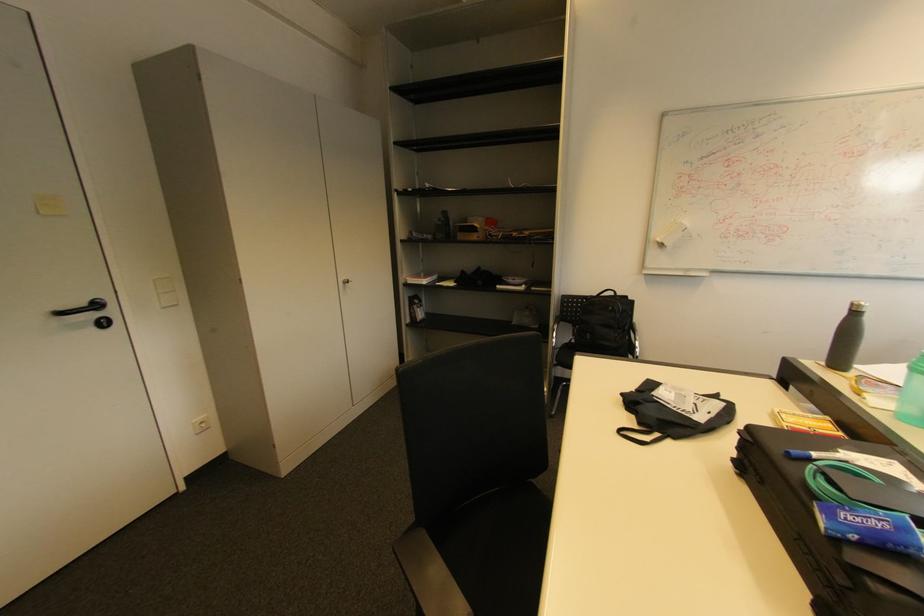
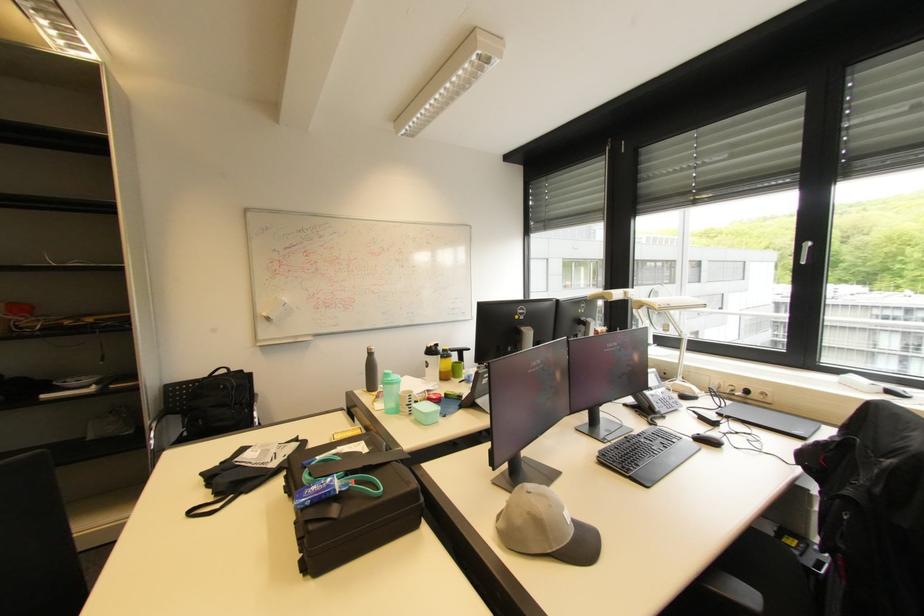
The point at (624, 294) is marked in the first image. Where is the corresponding point in the second image?

(237, 371)